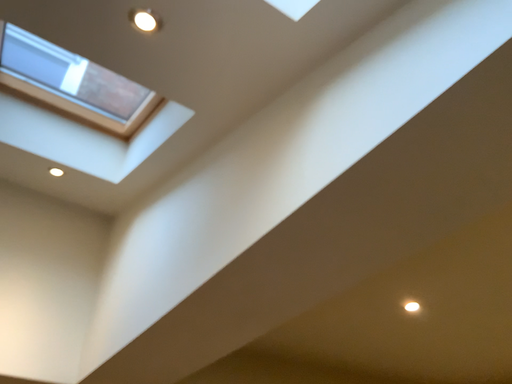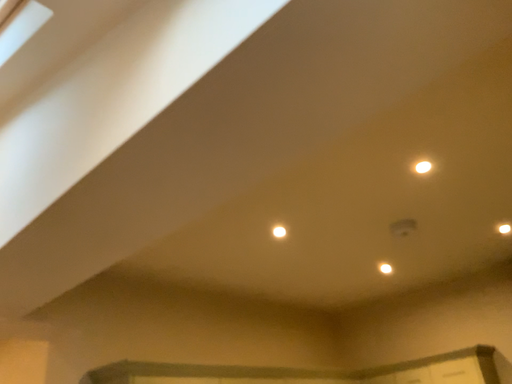
Question: How did the camera likely rotate when shooting the video?

Choices:
 (A) rotated right
 (B) rotated left

Answer: (A)